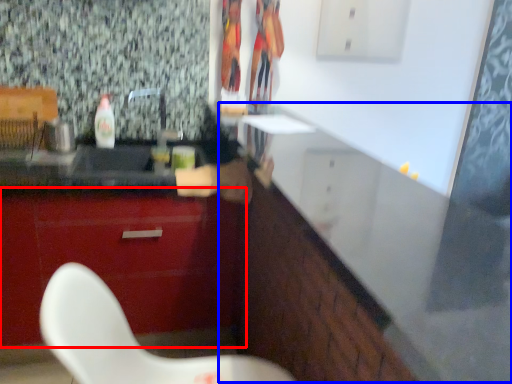
Question: Which object appears farthest to the camera in this image, cabinetry (highlighted by a red box) or counter (highlighted by a blue box)?

Choices:
 (A) cabinetry
 (B) counter

Answer: (A)